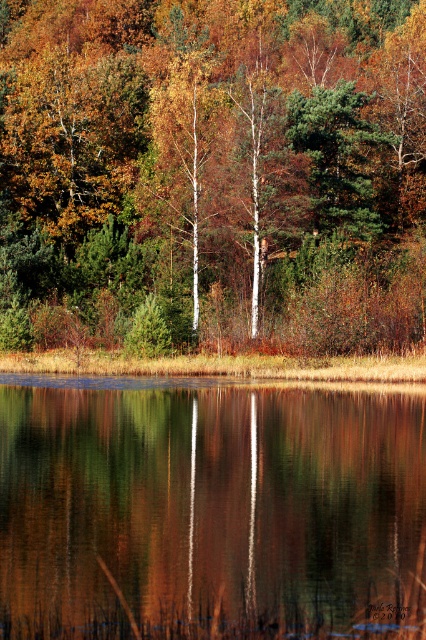
Question: Which object is the closest to the autumn leaves at center?

Choices:
 (A) white smooth birch tree at center
 (B) green matte tree at center
 (C) green reflective water at center

Answer: (A)

Question: Which point is closer to the camera?

Choices:
 (A) white smooth birch tree at center
 (B) green matte tree at center
 (C) autumn leaves at center
 (D) green reflective water at center

Answer: (D)

Question: Can you confirm if white smooth birch tree at center is positioned above green matte tree at center?

Choices:
 (A) yes
 (B) no

Answer: (A)

Question: Is green reflective water at center positioned behind white smooth birch tree at center?

Choices:
 (A) yes
 (B) no

Answer: (B)

Question: Does green reflective water at center appear over green matte tree at center?

Choices:
 (A) yes
 (B) no

Answer: (B)

Question: Which point appears closest to the camera in this image?

Choices:
 (A) (382, 240)
 (B) (340, 186)
 (C) (48, 618)
 (D) (157, 163)

Answer: (C)